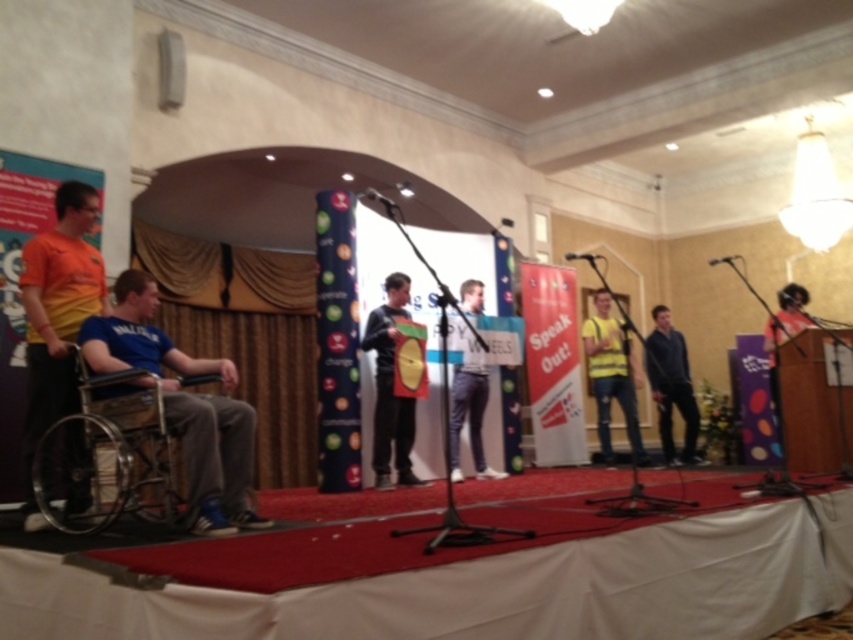
The image size is (853, 640). Describe the element at coordinates (380, 198) in the screenshot. I see `metallic silver microphone at upper center` at that location.

Identify the location of metallic silver microphone at upper center. This screenshot has width=853, height=640. (380, 198).

This screenshot has height=640, width=853. In order to click on metallic silver microphone at upper center in this screenshot , I will do `click(380, 198)`.

Between light blue jeans at center and metallic silver microphone at upper center, which one has more height?

light blue jeans at center

Who is positioned more to the left, light blue jeans at center or metallic silver microphone at upper center?

From the viewer's perspective, metallic silver microphone at upper center appears more on the left side.

Does point (480, 384) come closer to viewer compared to point (380, 198)?

No, it is not.

The width and height of the screenshot is (853, 640). I want to click on light blue jeans at center, so click(x=469, y=403).

How distant is light blue jeans at center from dark blue shirt at center?

light blue jeans at center is 2.02 meters away from dark blue shirt at center.

Who is higher up, light blue jeans at center or dark blue shirt at center?

light blue jeans at center

Does point (474, 371) come closer to viewer compared to point (686, 460)?

Yes, point (474, 371) is in front of point (686, 460).

You are a GUI agent. You are given a task and a screenshot of the screen. Output one action in this format:
    pyautogui.click(x=<x>, y=<y>)
    Task: Click on the light blue jeans at center
    The width and height of the screenshot is (853, 640).
    Given the screenshot: What is the action you would take?
    (x=469, y=403)